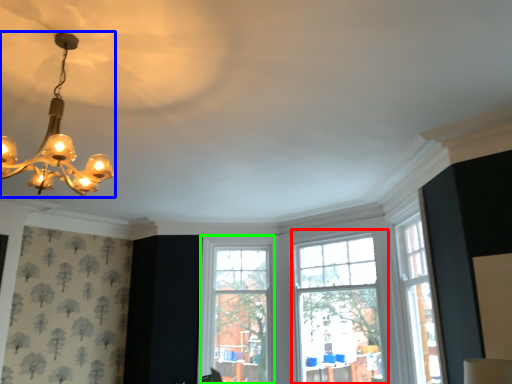
Question: Which object is positioned closest to window (highlighted by a red box)? Select from lamp (highlighted by a blue box) and window (highlighted by a green box).

Choices:
 (A) lamp
 (B) window

Answer: (B)